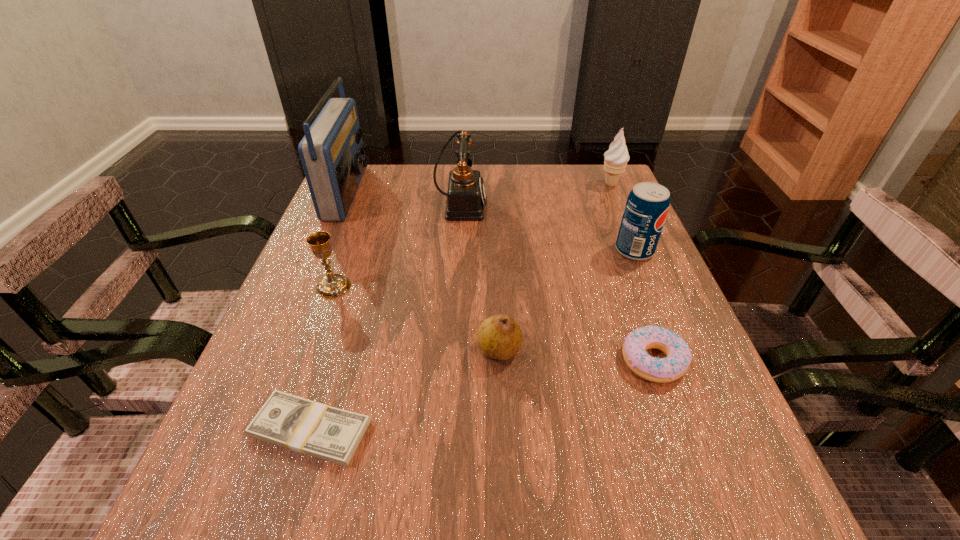
Locate an element on the screen. The image size is (960, 540). the tallest object is located at coordinates (332, 153).

Find the location of a particular element. The image size is (960, 540). telephone is located at coordinates (466, 197).

You are a GUI agent. You are given a task and a screenshot of the screen. Output one action in this format:
    pyautogui.click(x=<x>, y=<y>)
    Task: Click on the icecream
    
    Given the screenshot: What is the action you would take?
    pos(616,158)

Find the location of `pop`. pop is located at coordinates (647, 205).

You are a GUI agent. You are given a task and a screenshot of the screen. Output one action in this format:
    pyautogui.click(x=<x>, y=<y>)
    Task: Click on the chalice
    
    Given the screenshot: What is the action you would take?
    pyautogui.click(x=332, y=285)

This screenshot has width=960, height=540. Identify the location of the fifth tallest object. (332, 285).

The height and width of the screenshot is (540, 960). I want to click on pear, so click(x=499, y=337).

Locate an element on the screen. Image resolution: width=960 pixels, height=540 pixels. doughnut is located at coordinates (659, 370).

The width and height of the screenshot is (960, 540). I want to click on the nearest object, so click(x=301, y=425).

Image resolution: width=960 pixels, height=540 pixels. In order to click on the shortest object in this screenshot , I will do `click(301, 425)`.